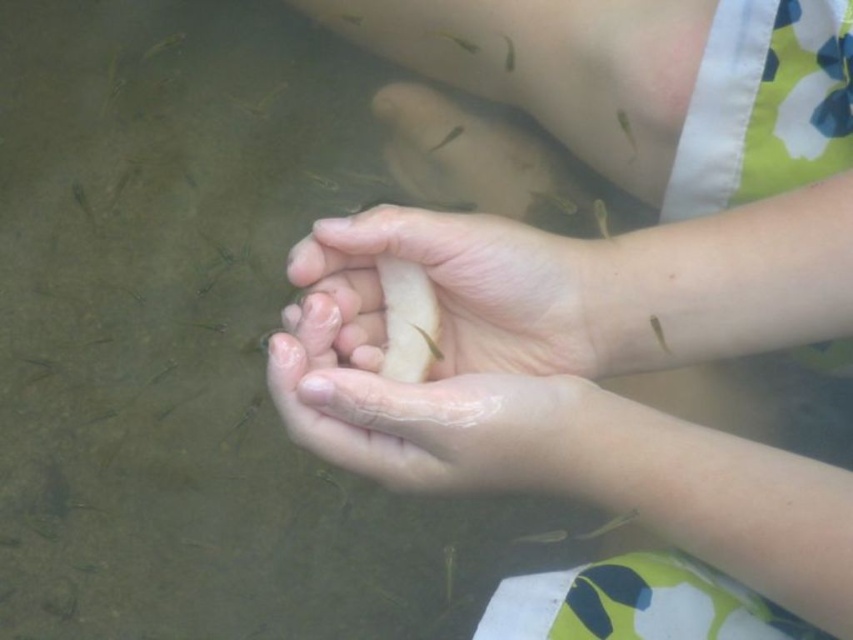
Based on the scene described, where exactly are the smooth skin hands at center positioned in terms of coordinates?

The smooth skin hands at center are positioned at coordinates (610, 301).

You are a photographer trying to capture a closeup of the fish near the hands in the image. You notice two points marked as point 1 and point 2. Point 1 is at coordinates point (476, 422) and point 2 is at point (589, 344). Which point is closer to the camera?

Point 1 at coordinates point (476, 422) is closer to the camera than point 2 at point (589, 344) because it is in front of it.

What is located at the coordinates point (428, 417) in the image?

The point (428, 417) corresponds to translucent skin at center.